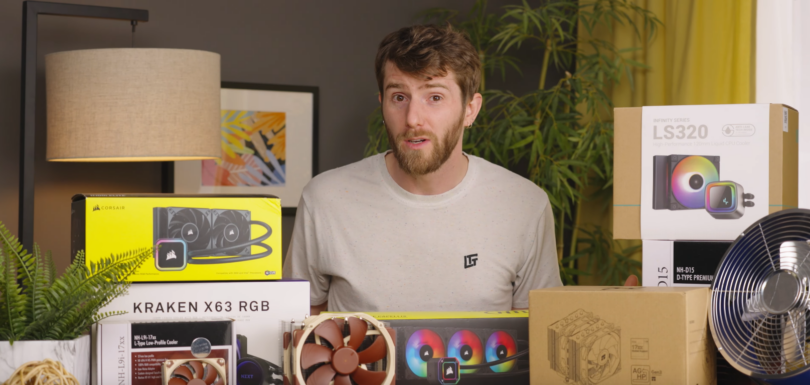
Locate an element on the screen. The width and height of the screenshot is (810, 385). green bamboo plant in corner is located at coordinates (587, 119), (539, 119).